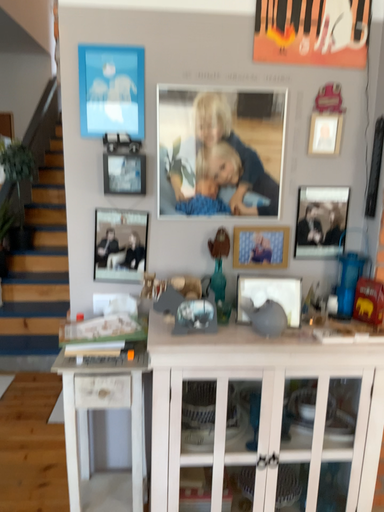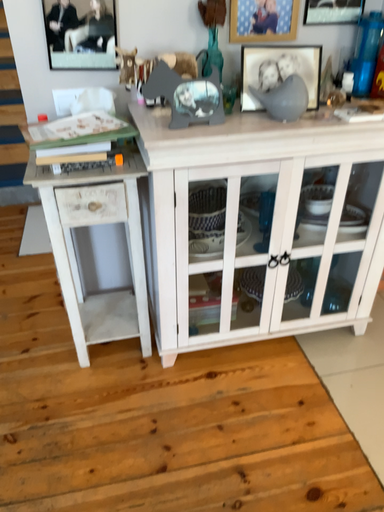
Question: Which way did the camera rotate in the video?

Choices:
 (A) rotated right
 (B) rotated left

Answer: (A)